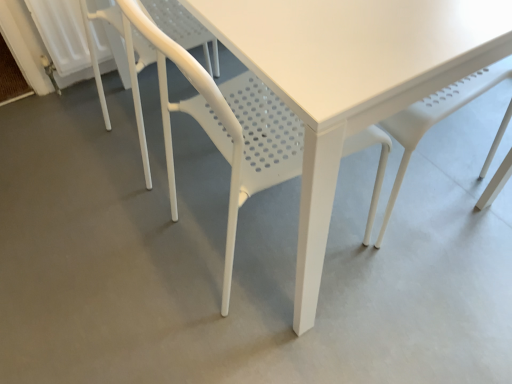
Question: Is white plastic chair at lower left, acting as the first chair starting from the left, situated inside white plastic chair at center, the 1th chair positioned from the right, or outside?

Choices:
 (A) inside
 (B) outside

Answer: (B)

Question: Would you say white plastic chair at lower left, acting as the first chair starting from the left, is to the left or to the right of white plastic chair at center, the 1th chair positioned from the right, in the picture?

Choices:
 (A) right
 (B) left

Answer: (B)

Question: From a real-world perspective, relative to white plastic chair at center, the 1th chair positioned from the right, is white plastic chair at lower left, acting as the first chair starting from the left, vertically above or below?

Choices:
 (A) below
 (B) above

Answer: (A)

Question: In terms of height, does white plastic chair at center, the 1th chair positioned from the right, look taller or shorter compared to white plastic chair at lower left, acting as the first chair starting from the left?

Choices:
 (A) short
 (B) tall

Answer: (B)

Question: From a real-world perspective, relative to white plastic chair at lower left, which is the 2th chair in right-to-left order, is white plastic chair at center, the 1th chair positioned from the right, vertically above or below?

Choices:
 (A) above
 (B) below

Answer: (A)

Question: From the image's perspective, is white plastic chair at center, the second chair in the left-to-right sequence, above or below white plastic chair at lower left, which is the 2th chair in right-to-left order?

Choices:
 (A) below
 (B) above

Answer: (A)

Question: Considering the positions of point (241, 130) and point (180, 43), is point (241, 130) closer or farther from the camera than point (180, 43)?

Choices:
 (A) closer
 (B) farther

Answer: (A)